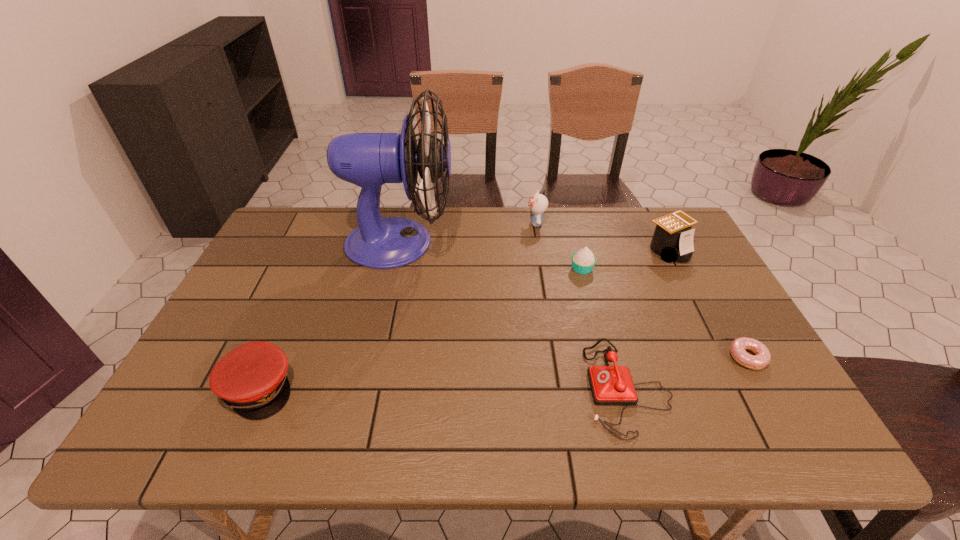
This screenshot has height=540, width=960. In order to click on free space that is in between the cupcake and the shortest object in this screenshot , I will do `click(664, 313)`.

Locate an element on the screen. This screenshot has width=960, height=540. free point between the fifth object from right to left and the cap is located at coordinates (397, 306).

You are a GUI agent. You are given a task and a screenshot of the screen. Output one action in this format:
    pyautogui.click(x=<x>, y=<y>)
    Task: Click on the vacant space that is in between the cap and the calculator
    This screenshot has height=540, width=960.
    Given the screenshot: What is the action you would take?
    pyautogui.click(x=463, y=319)

Identify the location of unoccupied position between the cupcake and the fan. The height and width of the screenshot is (540, 960). (492, 255).

Find the location of `free space between the shortest object and the calculator`. free space between the shortest object and the calculator is located at coordinates (708, 303).

At what (x,y) coordinates should I click in order to perform the action: click on object that is the fifth closest to the tallest object. Please return your answer as a coordinate pair (x, y). The image size is (960, 540). Looking at the image, I should click on (673, 238).

Identify the location of the third closest object to the fan. (583, 261).

In order to click on blank space that satisfies the following two spatial constraints: 1. in front of the cupcake where the airflow is directed; 2. on the right side of the fan in this screenshot , I will do `click(395, 268)`.

Locate an element on the screen. This screenshot has height=540, width=960. vacant region that satisfies the following two spatial constraints: 1. on the back side of the shortest object; 2. in front of the tallest object where the airflow is directed is located at coordinates (684, 243).

You are a GUI agent. You are given a task and a screenshot of the screen. Output one action in this format:
    pyautogui.click(x=<x>, y=<y>)
    Task: Click on the vacant point that satisfies the following two spatial constraints: 1. on the back side of the cupcake; 2. in front of the fan where the airflow is directed
    The width and height of the screenshot is (960, 540).
    Given the screenshot: What is the action you would take?
    pyautogui.click(x=575, y=243)